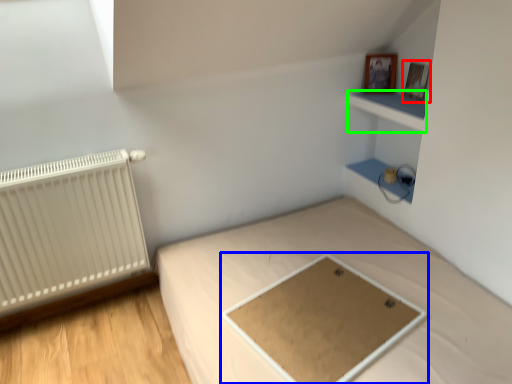
Question: Which object is the farthest from picture frame (highlighted by a red box)? Choose among these: table (highlighted by a blue box) or cabinet (highlighted by a green box).

Choices:
 (A) table
 (B) cabinet

Answer: (A)